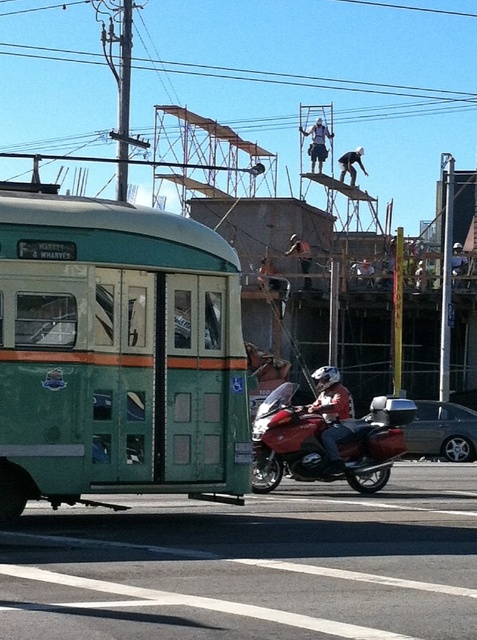
Does point (342, 406) come closer to viewer compared to point (300, 246)?

That is True.

Which is below, red leather jacket at center or metallic helmet at center?

red leather jacket at center is lower down.

This screenshot has height=640, width=477. What do you see at coordinates (332, 413) in the screenshot?
I see `red leather jacket at center` at bounding box center [332, 413].

Identify the location of red leather jacket at center. (332, 413).

Locate an element on the screen. The image size is (477, 640). red leather jacket at center is located at coordinates (332, 413).

What do you see at coordinates (332, 413) in the screenshot?
I see `red leather jacket at center` at bounding box center [332, 413].

I want to click on red leather jacket at center, so click(x=332, y=413).

Looking at this image, who is higher up, light blue fabric at center or matte black helmet at center?

light blue fabric at center is above.

Does point (311, 148) come farther from viewer compared to point (370, 268)?

Yes.

Is point (324, 145) positioned in front of point (367, 284)?

That is False.

Identify the location of light blue fabric at center. The width and height of the screenshot is (477, 640). (317, 144).